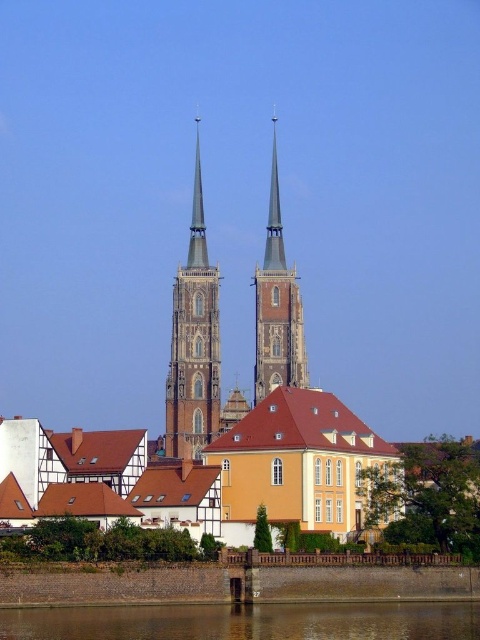
Question: Considering the real-world distances, which object is farthest from the brown concrete wall at lower center?

Choices:
 (A) brown stone tower at center
 (B) brown stone spire at center

Answer: (B)

Question: Which of the following is the farthest from the observer?

Choices:
 (A) (286, 380)
 (B) (197, 221)
 (C) (34, 632)

Answer: (B)

Question: Can you confirm if brown concrete wall at lower center is wider than brown stone tower at center?

Choices:
 (A) no
 (B) yes

Answer: (B)

Question: Is brown concrete wall at lower center above brown stone spire at center?

Choices:
 (A) yes
 (B) no

Answer: (B)

Question: Is brown stone tower at center bigger than brown stone spire at center?

Choices:
 (A) no
 (B) yes

Answer: (B)

Question: Which point is farther to the camera?

Choices:
 (A) brown stone spire at center
 (B) brown concrete wall at lower center

Answer: (A)